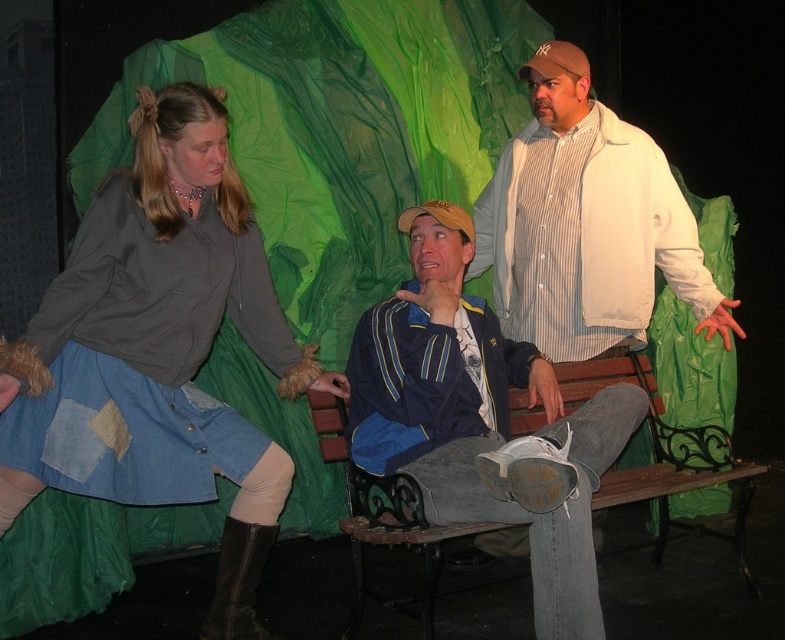
In the scene shown: Does white striped shirt at upper center appear on the right side of wooden bench at center?

In fact, white striped shirt at upper center is to the left of wooden bench at center.

Who is higher up, white striped shirt at upper center or wooden bench at center?

white striped shirt at upper center is above.

Image resolution: width=785 pixels, height=640 pixels. In order to click on white striped shirt at upper center in this screenshot , I will do `click(586, 225)`.

From the picture: Which is above, denim skirt at left or blue fabric jacket at center?

denim skirt at left is higher up.

Who is shorter, denim skirt at left or blue fabric jacket at center?

Standing shorter between the two is blue fabric jacket at center.

Is point (252, 301) less distant than point (579, 604)?

No, (252, 301) is further to viewer.

Image resolution: width=785 pixels, height=640 pixels. I want to click on denim skirt at left, so click(159, 349).

Measure the distance between point (243,596) and camera.

The distance of point (243,596) from camera is 2.40 meters.

Does denim skirt at left have a greater width compared to brown suede boot at lower left?

Yes, denim skirt at left is wider than brown suede boot at lower left.

Who is more forward, (170,365) or (243,529)?

Point (170,365) is more forward.

The image size is (785, 640). Find the location of `denim skirt at left`. denim skirt at left is located at coordinates (159, 349).